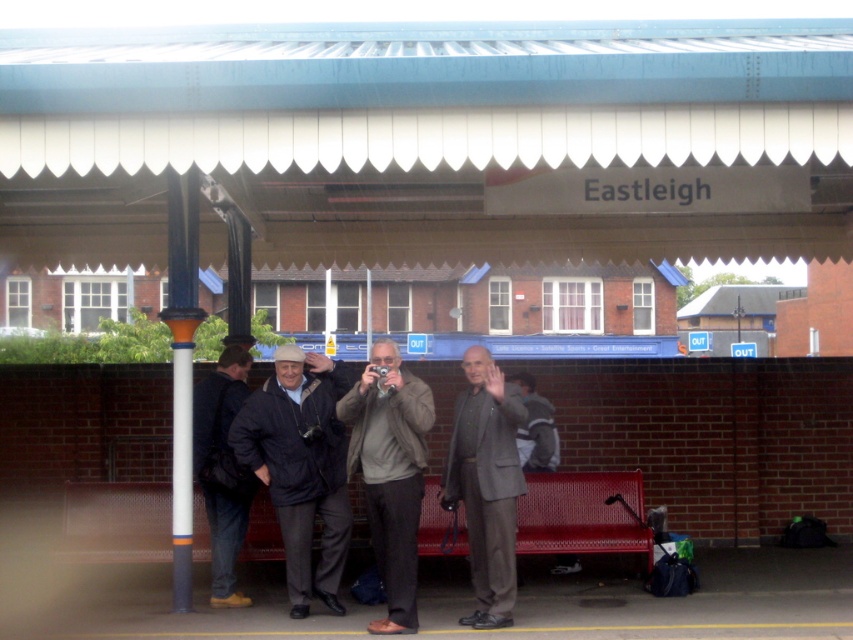
Is point (357, 387) positioned in front of point (480, 577)?

Yes, it is in front of point (480, 577).

What do you see at coordinates (390, 472) in the screenshot?
I see `gray woolen jacket at center` at bounding box center [390, 472].

Does point (413, 435) come closer to viewer compared to point (447, 476)?

Yes, point (413, 435) is closer to viewer.

I want to click on gray woolen jacket at center, so click(390, 472).

Is point (321, 481) farther from viewer compared to point (224, 538)?

No, it is in front of (224, 538).

Who is higher up, matte black jacket at center or dark blue jeans at left?

dark blue jeans at left is higher up.

What do you see at coordinates (300, 467) in the screenshot?
I see `matte black jacket at center` at bounding box center [300, 467].

The height and width of the screenshot is (640, 853). Find the location of `matte black jacket at center`. matte black jacket at center is located at coordinates (300, 467).

Measure the distance between point [509,618] and camera.

They are 29.68 feet apart.

Who is higher up, dark gray suit at center or dark blue jeans at left?

dark blue jeans at left is above.

What do you see at coordinates (486, 484) in the screenshot? I see `dark gray suit at center` at bounding box center [486, 484].

Where is `dark gray suit at center`? dark gray suit at center is located at coordinates (486, 484).